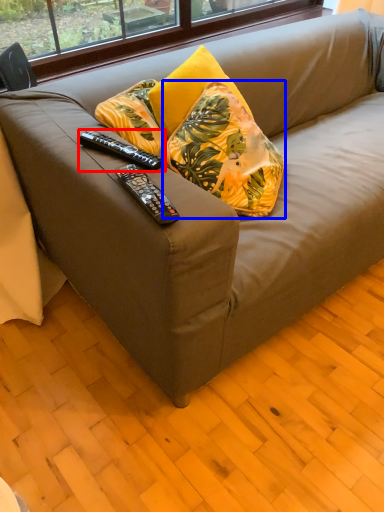
Question: Which of the following is the farthest to the observer, remote control (highlighted by a red box) or pillow (highlighted by a blue box)?

Choices:
 (A) remote control
 (B) pillow

Answer: (B)